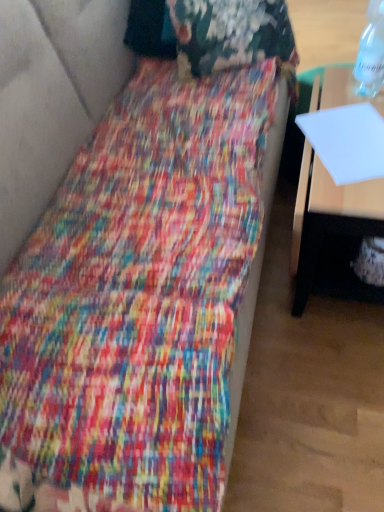
What is the approximate width of light brown wooden table at right?

The width of light brown wooden table at right is 14.19 inches.

This screenshot has height=512, width=384. Describe the element at coordinates (329, 218) in the screenshot. I see `light brown wooden table at right` at that location.

This screenshot has height=512, width=384. What are the coordinates of `light brown wooden table at right` in the screenshot? It's located at (329, 218).

Locate an element on the screen. This screenshot has height=512, width=384. light brown wooden table at right is located at coordinates (329, 218).